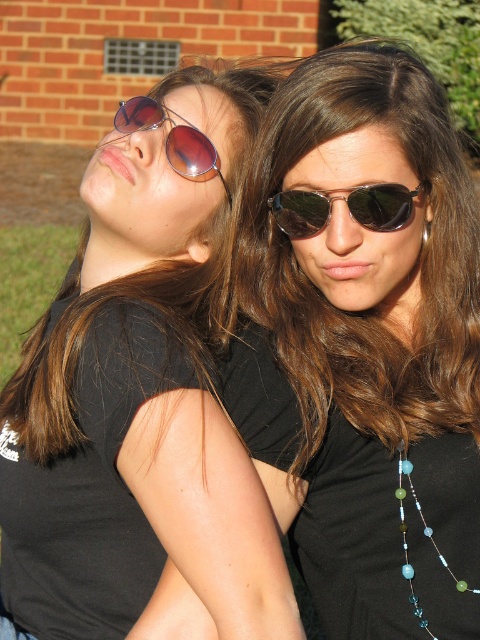
You are a photographer adjusting your camera settings. You notice the matte black sunglasses at upper left and the translucent glass beads at center in the frame. Which object has a wider physical dimension?

The matte black sunglasses at upper left has a larger width than the translucent glass beads at center, so the sunglasses are wider.

You are taking a photo of two people standing in front of you. The first person is at point (124, 124) and the second is at point (398, 484). Which person is closer to the camera?

Point (398, 484) is closer to the camera because point (124, 124) is behind it.

You are a photographer trying to capture a closeup shot of the metallic reflective sunglasses at upper center and the translucent glass beads at center. Since you want to focus on the sunglasses, which object should you prioritize keeping in the frame and why?

You should prioritize keeping the metallic reflective sunglasses at upper center in the frame because its width is larger than the translucent glass beads at center, making it more visually prominent.